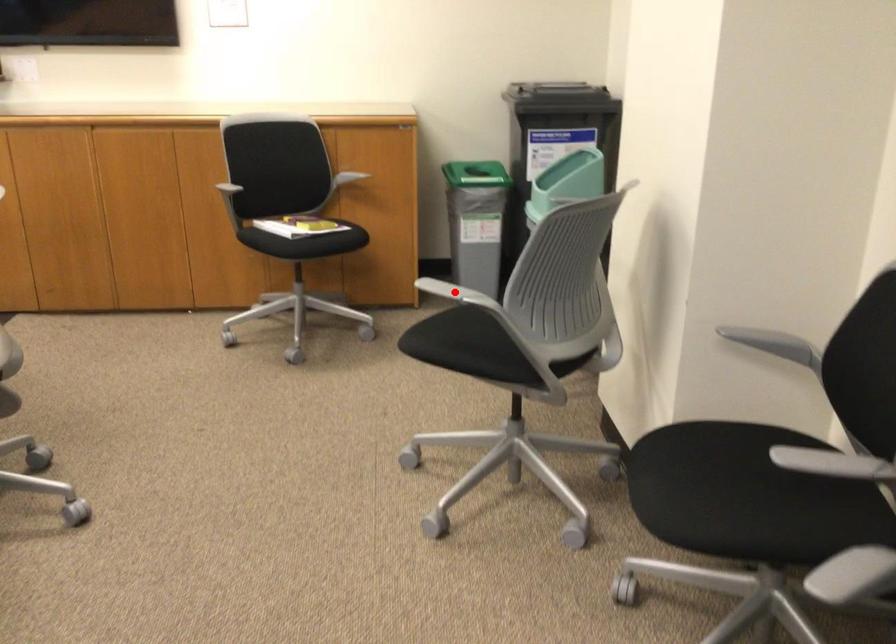
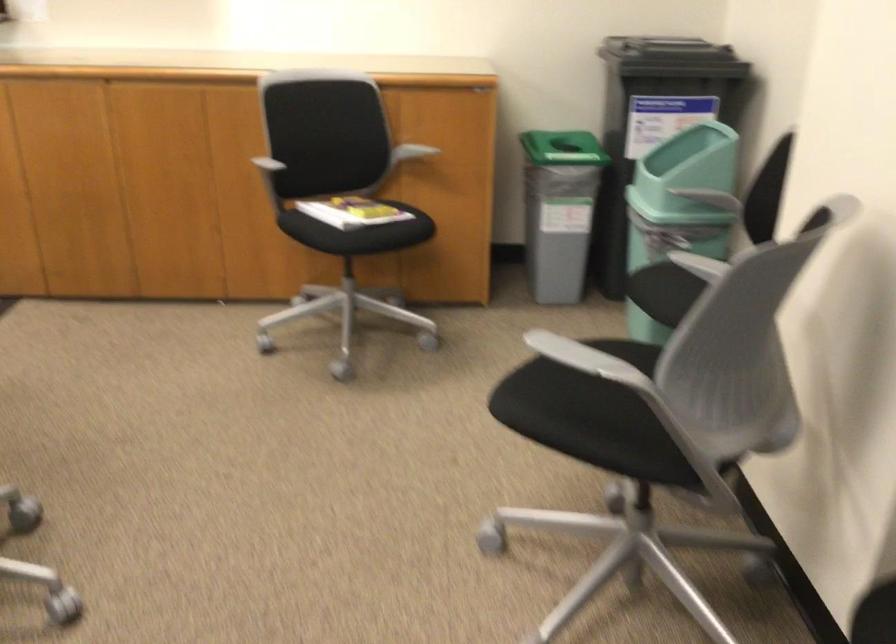
Where in the second image is the point corresponding to the highlighted location from the first image?

(583, 357)